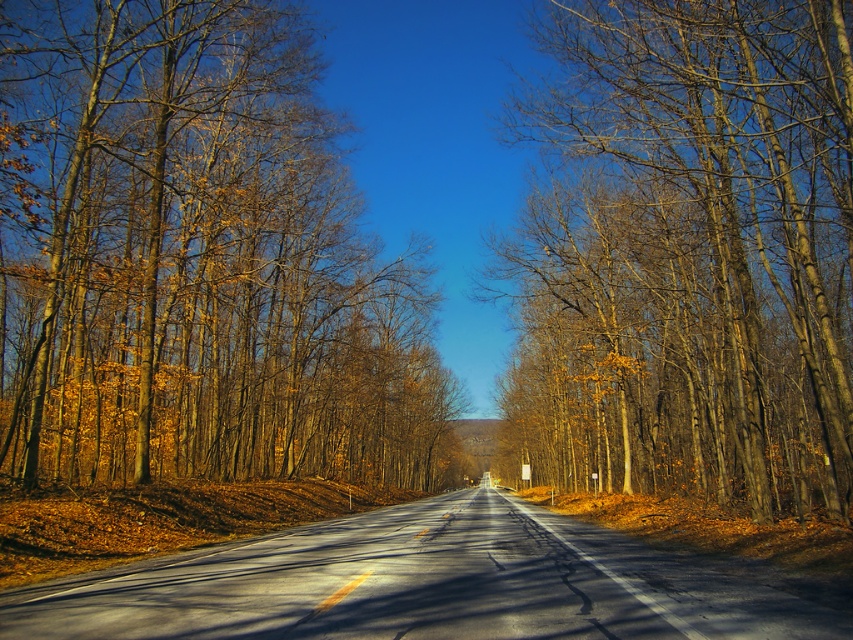
You are a hiker standing on the two lane road and want to take a photo of both the brown bark tree at center and the brown wood tree at center. Which tree should you focus on first to ensure both are in the frame?

You should focus on the brown bark tree at center first because it is larger in size than the brown wood tree at center, so it will be more noticeable and easier to frame both trees together.